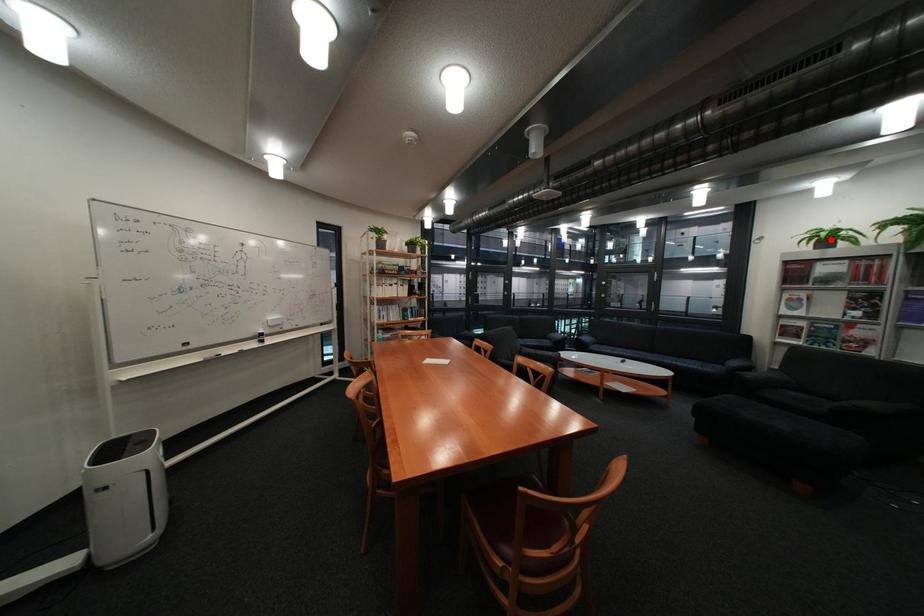
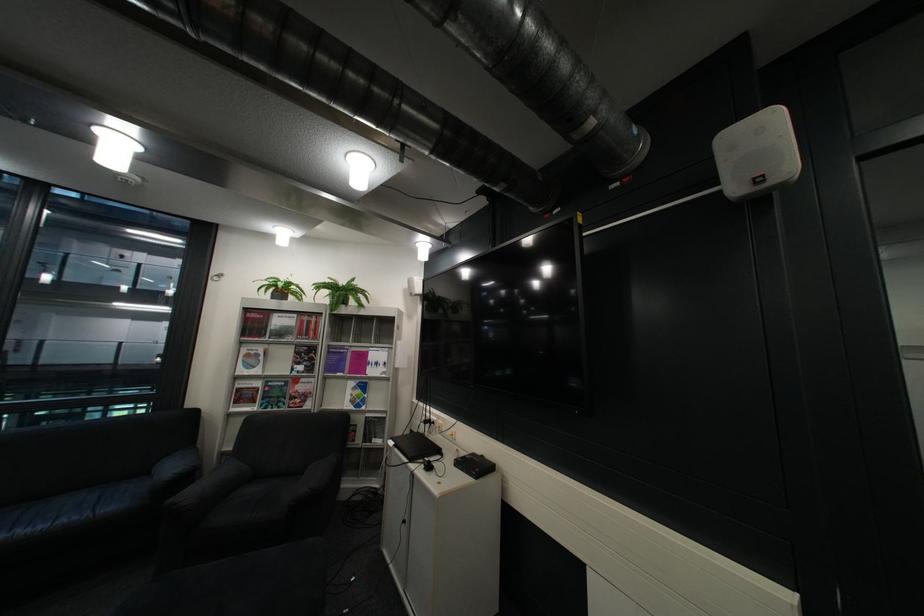
Find the pixel in the second image that matches the highlighted location in the first image.

(287, 290)